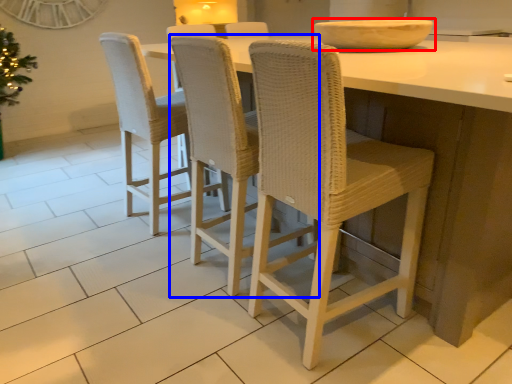
Question: Which of the following is the farthest to the observer, bowl (highlighted by a red box) or chair (highlighted by a blue box)?

Choices:
 (A) bowl
 (B) chair

Answer: (A)